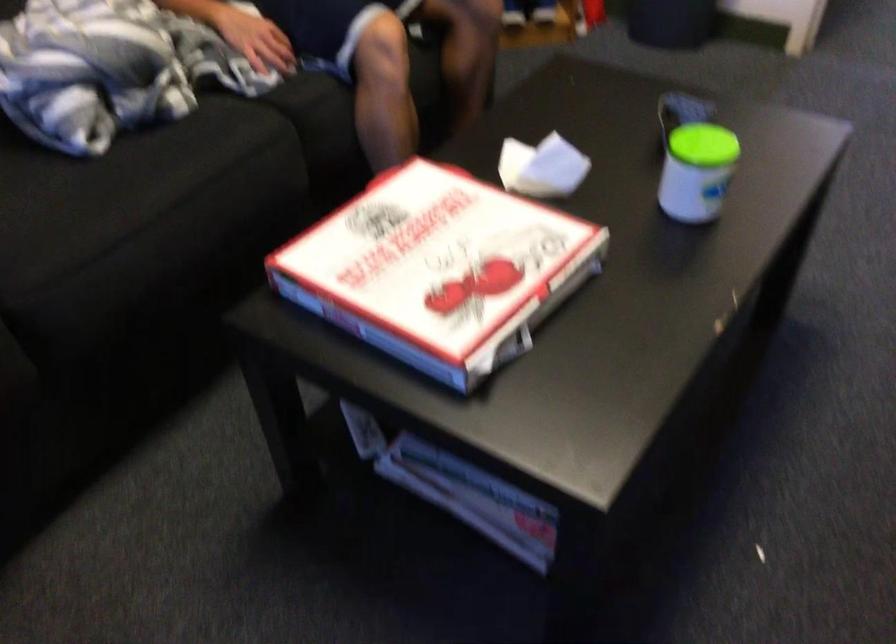
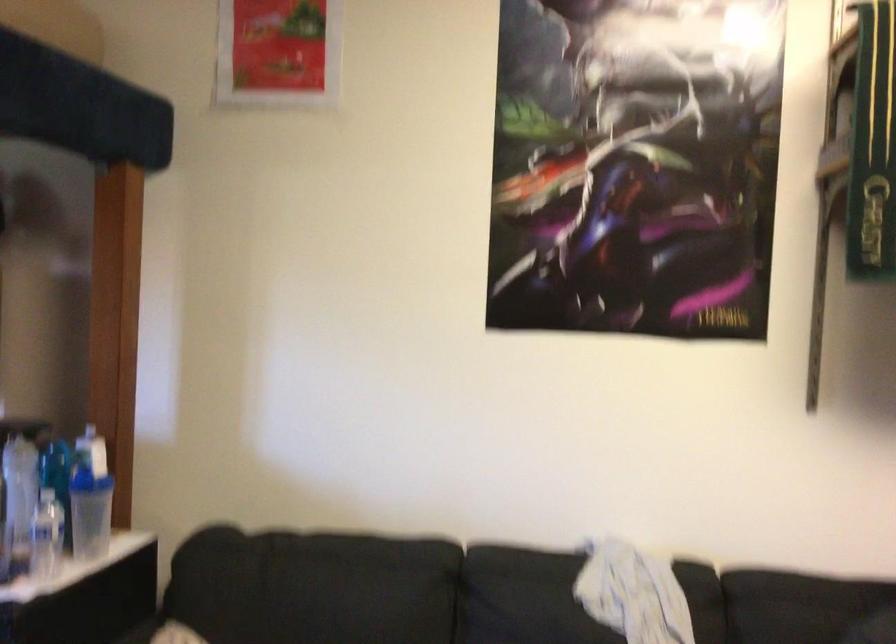
Question: The first image is from the beginning of the video and the second image is from the end. How did the camera likely rotate when shooting the video?

Choices:
 (A) Left
 (B) Right
 (C) Up
 (D) Down

Answer: (A)